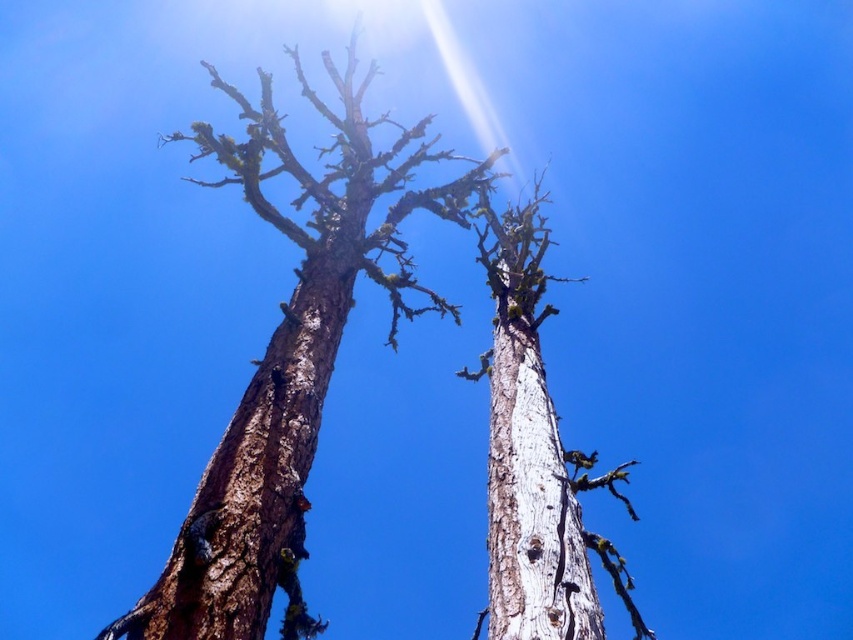
Between point (289, 460) and point (306, 396), which one is positioned behind?

The point (306, 396) is more distant.

Is brown rough bark tree at center wider than brown rough bark tree trunk at center?

Correct, the width of brown rough bark tree at center exceeds that of brown rough bark tree trunk at center.

What are the coordinates of `brown rough bark tree at center` in the screenshot? It's located at (289, 364).

Between point (286, 410) and point (532, 604), which one is positioned in front?

Point (532, 604) is in front.

Describe the element at coordinates (254, 484) in the screenshot. This screenshot has height=640, width=853. I see `brown rough bark tree trunk at center` at that location.

Does point (248, 435) lie in front of point (511, 364)?

Yes, it is.

What are the coordinates of `brown rough bark tree trunk at center` in the screenshot? It's located at (254, 484).

Who is positioned more to the left, brown rough bark tree at center or white rough bark tree trunk at center?

brown rough bark tree at center is more to the left.

Which is behind, point (218, 515) or point (508, 557)?

Positioned behind is point (508, 557).

Between point (392, 189) and point (543, 513), which one is positioned behind?

Positioned behind is point (392, 189).

What are the coordinates of `brown rough bark tree at center` in the screenshot? It's located at tap(289, 364).